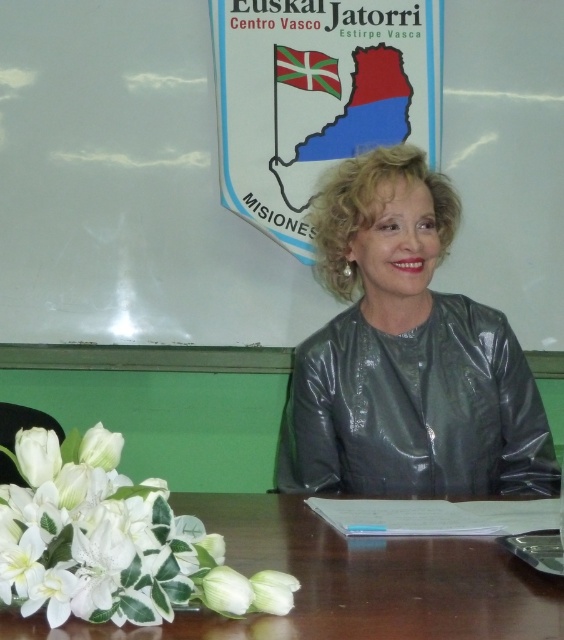
Which of these two, leather jacket at center or white silk flowers at lower left, stands shorter?

Standing shorter between the two is white silk flowers at lower left.

Between point (465, 449) and point (63, 522), which one is positioned behind?

The point (465, 449) is more distant.

At what (x,y) coordinates should I click in order to perform the action: click on leather jacket at center. Please return your answer as a coordinate pair (x, y). This screenshot has height=640, width=564. Looking at the image, I should click on (406, 355).

Is point (235, 291) farther from viewer compared to point (343, 294)?

That is True.

Is whiteboard at upper center positioned behind leather jacket at center?

Yes, whiteboard at upper center is behind leather jacket at center.

Where is `whiteboard at upper center`? The image size is (564, 640). whiteboard at upper center is located at coordinates (127, 188).

Describe the element at coordinates (127, 188) in the screenshot. I see `whiteboard at upper center` at that location.

Who is lower down, whiteboard at upper center or white silk flowers at lower left?

white silk flowers at lower left is below.

At what (x,y) coordinates should I click in order to perform the action: click on whiteboard at upper center. Please return your answer as a coordinate pair (x, y). The width and height of the screenshot is (564, 640). Looking at the image, I should click on (127, 188).

Locate an element on the screen. The image size is (564, 640). whiteboard at upper center is located at coordinates (127, 188).